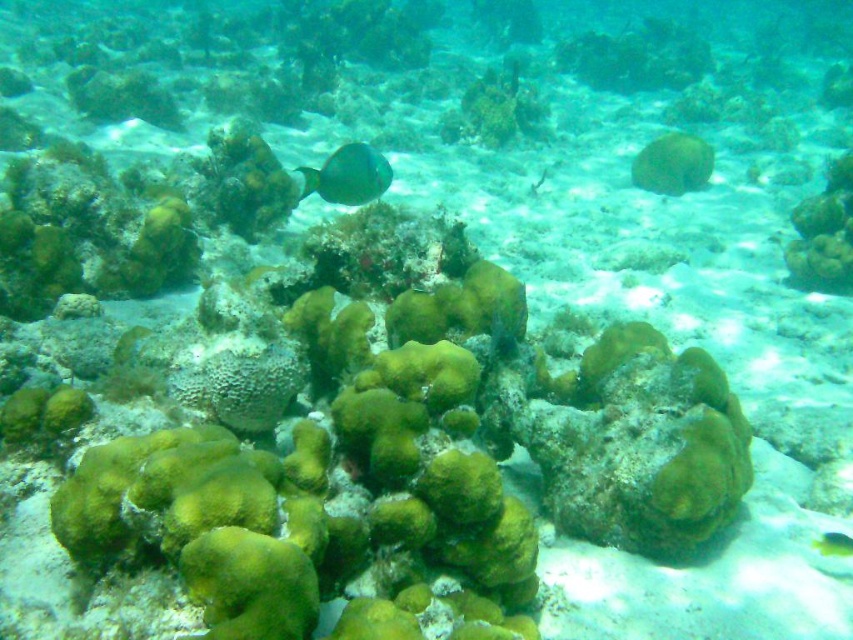
Where is `shiny blue fish at center`? This screenshot has width=853, height=640. shiny blue fish at center is located at coordinates (347, 176).

Where is `shiny blue fish at center`? The image size is (853, 640). shiny blue fish at center is located at coordinates 347,176.

Is green matte coral at upper center below green matte fish at center?

Incorrect, green matte coral at upper center is not positioned below green matte fish at center.

Is green matte coral at upper center behind green matte fish at center?

Yes, it is.

Locate an element on the screen. green matte coral at upper center is located at coordinates (672, 164).

Identify the location of green matte coral at upper center. (672, 164).

Does point (380, 176) lie in front of point (822, 536)?

No, (380, 176) is behind (822, 536).

Measure the distance between point (366, 164) and camera.

Answer: The distance of point (366, 164) from camera is 8.93 feet.

The height and width of the screenshot is (640, 853). In order to click on shiny blue fish at center in this screenshot , I will do `click(347, 176)`.